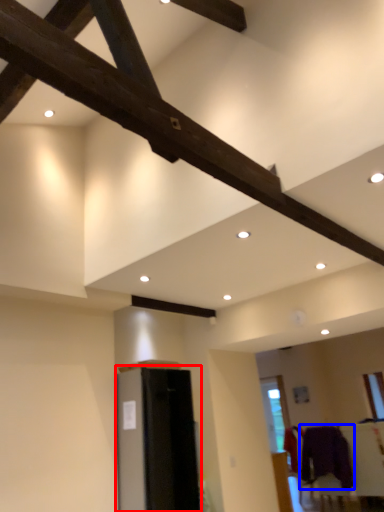
Question: Among these objects, which one is farthest to the camera, furniture (highlighted by a red box) or clothing (highlighted by a blue box)?

Choices:
 (A) furniture
 (B) clothing

Answer: (B)